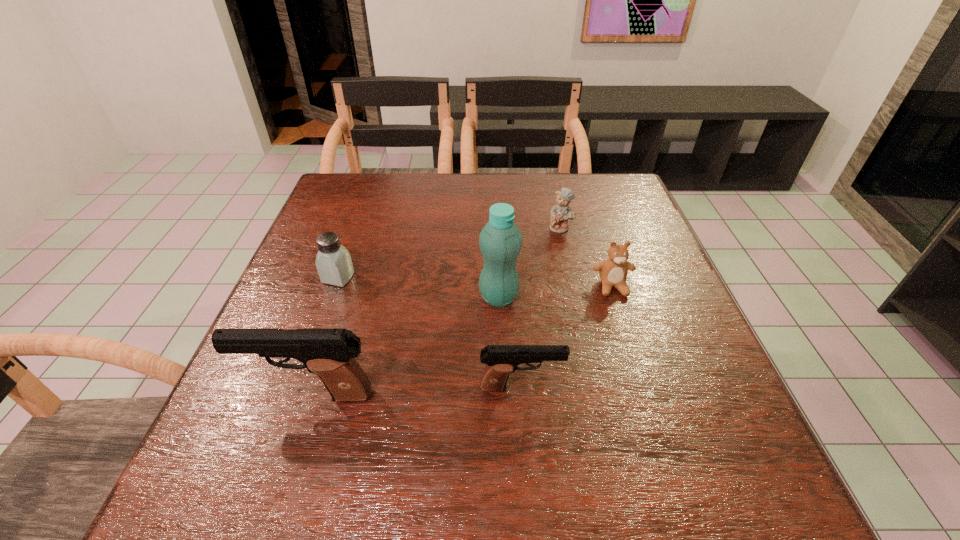
You are a GUI agent. You are given a task and a screenshot of the screen. Output one action in this format:
    pyautogui.click(x=<x>, y=<y>)
    Task: Click on the vacant place for an extra pistol on the right
    This screenshot has height=540, width=960.
    Given the screenshot: What is the action you would take?
    pyautogui.click(x=725, y=380)